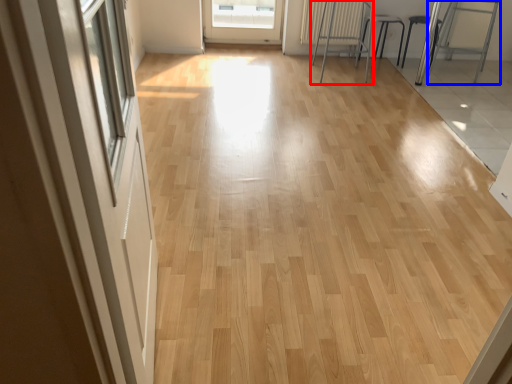
Question: Which object is further to the camera taking this photo, furniture (highlighted by a red box) or armchair (highlighted by a blue box)?

Choices:
 (A) furniture
 (B) armchair

Answer: (B)